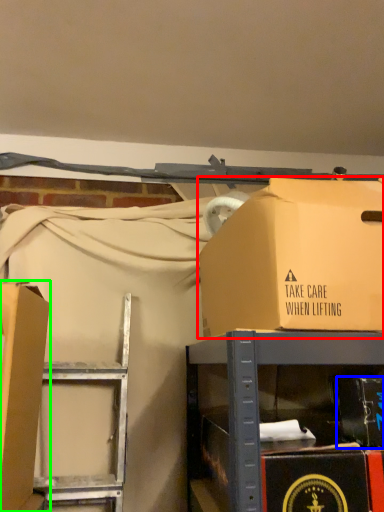
Question: Which object is positioned closest to box (highlighted by a red box)? Select from box (highlighted by a blue box) and box (highlighted by a green box).

Choices:
 (A) box
 (B) box

Answer: (A)